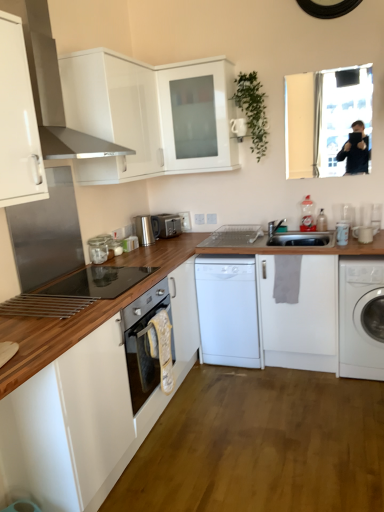
Image resolution: width=384 pixels, height=512 pixels. Describe the element at coordinates (150, 114) in the screenshot. I see `white glossy cabinet at upper center, acting as the fourth cabinetry starting from the bottom` at that location.

Identify the location of satin silver toaster at center, which is counted as the 1th appliance, starting from the left. This screenshot has width=384, height=512. (166, 225).

The width and height of the screenshot is (384, 512). Describe the element at coordinates (166, 225) in the screenshot. I see `satin silver toaster at center, the 1th appliance in the back-to-front sequence` at that location.

What are the coordinates of `white glossy mug at right, the 4th appliance positioned from the back` in the screenshot? It's located at (364, 233).

What do you see at coordinates (86, 389) in the screenshot?
I see `wooden countertop at center, which appears as the fifth cabinetry when viewed from the top` at bounding box center [86, 389].

This screenshot has height=512, width=384. In order to click on white plastic dishwasher at center, positioned as the 3th appliance in front-to-back order in this screenshot , I will do `click(233, 236)`.

Visually, is white plastic dishwasher at center, the 3th appliance from the right, positioned to the left or to the right of white matte dishwasher at center, acting as the 1th washing machine starting from the left?

white plastic dishwasher at center, the 3th appliance from the right, is to the right of white matte dishwasher at center, acting as the 1th washing machine starting from the left.

Who is bigger, white plastic dishwasher at center, the second appliance viewed from the back, or white matte dishwasher at center, acting as the 1th washing machine starting from the left?

With larger size is white matte dishwasher at center, acting as the 1th washing machine starting from the left.

Considering the points (252, 243) and (253, 287), which point is behind, point (252, 243) or point (253, 287)?

The point (252, 243) is more distant.

Between white plastic dishwasher at center, the 3th appliance from the right, and white matte dishwasher at center, marked as the 2th washing machine in a right-to-left arrangement, which one has smaller width?

Thinner between the two is white plastic dishwasher at center, the 3th appliance from the right.

Does clear glass jar at center, arranged as the second kitchen appliance when viewed from the top, turn towards white glossy cabinet at upper left, which ranks as the 3th cabinetry in bottom-to-top order?

No, clear glass jar at center, arranged as the second kitchen appliance when viewed from the top, is not oriented towards white glossy cabinet at upper left, which ranks as the 3th cabinetry in bottom-to-top order.

Which of these two, clear glass jar at center, arranged as the 2th kitchen appliance when viewed from the back, or white glossy cabinet at upper left, the third cabinetry when ordered from top to bottom, stands taller?

white glossy cabinet at upper left, the third cabinetry when ordered from top to bottom, is taller.

Could white glossy cabinet at upper left, the third cabinetry when ordered from top to bottom, be considered to be inside clear glass jar at center, the second kitchen appliance viewed from the right?

No, white glossy cabinet at upper left, the third cabinetry when ordered from top to bottom, is not a part of clear glass jar at center, the second kitchen appliance viewed from the right.

Does point (142, 243) appear closer or farther from the camera than point (340, 223)?

Point (142, 243).

From the image's perspective, which one is positioned lower, satin silver toaster at center, positioned as the second kitchen appliance in left-to-right order, or white glossy mug at right, which is counted as the 2th appliance, starting from the right?

white glossy mug at right, which is counted as the 2th appliance, starting from the right, from the image's perspective.

Is white glossy mug at right, which is counted as the 2th appliance, starting from the right, surrounded by satin silver toaster at center, positioned as the second kitchen appliance in left-to-right order?

That's incorrect, white glossy mug at right, which is counted as the 2th appliance, starting from the right, is not inside satin silver toaster at center, positioned as the second kitchen appliance in left-to-right order.

Is satin silver toaster at center, which is the first kitchen appliance from right to left, taller or shorter than white glossy mug at right, the 3th appliance positioned from the left?

In the image, satin silver toaster at center, which is the first kitchen appliance from right to left, appears to be taller than white glossy mug at right, the 3th appliance positioned from the left.

Is silver metallic faucet at center wider than wooden countertop at left, which is the fourth cabinetry from top to bottom?

Incorrect, the width of silver metallic faucet at center does not surpass that of wooden countertop at left, which is the fourth cabinetry from top to bottom.

From a real-world perspective, between silver metallic faucet at center and wooden countertop at left, which is the fourth cabinetry from top to bottom, who is vertically higher?

From a 3D spatial view, silver metallic faucet at center is above.

Is the position of silver metallic faucet at center more distant than that of wooden countertop at left, the second cabinetry when ordered from bottom to top?

Yes, silver metallic faucet at center is behind wooden countertop at left, the second cabinetry when ordered from bottom to top.

Which of these two, white plastic dishwasher at center, which is the second appliance from left to right, or metallic stainless steel range hood at upper left, stands shorter?

Standing shorter between the two is white plastic dishwasher at center, which is the second appliance from left to right.

Considering the positions of points (227, 234) and (33, 50), is point (227, 234) farther from camera compared to point (33, 50)?

Yes, it is behind point (33, 50).

Identify the location of appliance that is the 2nd object to the right of the metallic stainless steel range hood at upper left, starting at the anchor. This screenshot has height=512, width=384. click(233, 236).

How many degrees apart are the facing directions of white plastic dishwasher at center, positioned as the 3th appliance in front-to-back order, and metallic stainless steel range hood at upper left?

The facing directions of white plastic dishwasher at center, positioned as the 3th appliance in front-to-back order, and metallic stainless steel range hood at upper left are 90.1 degrees apart.

Is white glossy cabinet at upper left, the third cabinetry when ordered from top to bottom, to the left of white matte cabinet at upper center, which appears as the fifth cabinetry when ordered from the bottom, from the viewer's perspective?

Indeed, white glossy cabinet at upper left, the third cabinetry when ordered from top to bottom, is positioned on the left side of white matte cabinet at upper center, which appears as the fifth cabinetry when ordered from the bottom.

In terms of height, does white glossy cabinet at upper left, the third cabinetry when ordered from top to bottom, look taller or shorter compared to white matte cabinet at upper center, the first cabinetry from the top?

Clearly, white glossy cabinet at upper left, the third cabinetry when ordered from top to bottom, is shorter compared to white matte cabinet at upper center, the first cabinetry from the top.

From a real-world perspective, is white glossy cabinet at upper left, which ranks as the 3th cabinetry in bottom-to-top order, over white matte cabinet at upper center, which appears as the fifth cabinetry when ordered from the bottom?

No.

Consider the image. Does white glossy cabinet at upper left, the third cabinetry when ordered from top to bottom, have a smaller size compared to white matte cabinet at upper center, which appears as the fifth cabinetry when ordered from the bottom?

Yes.

Is silver metallic faucet at center further to camera compared to clear glass jar at center, the first kitchen appliance in the left-to-right sequence?

Yes, the depth of silver metallic faucet at center is greater than that of clear glass jar at center, the first kitchen appliance in the left-to-right sequence.

Which point is more distant from viewer, (279,221) or (93,255)?

The point (279,221) is farther.

From a real-world perspective, is silver metallic faucet at center physically above clear glass jar at center, which is the 1th kitchen appliance from front to back?

No, from a real-world perspective, silver metallic faucet at center is not above clear glass jar at center, which is the 1th kitchen appliance from front to back.

At what (x,y) coordinates should I click in order to perform the action: click on kitchen appliance in front of the silver metallic faucet at center. Please return your answer as a coordinate pair (x, y). This screenshot has width=384, height=512. Looking at the image, I should click on (98, 250).

From a real-world perspective, starting from the white matte dishwasher at center, acting as the 1th washing machine starting from the left, which appliance is the 1st one vertically above it? Please provide its 2D coordinates.

[(233, 236)]

Locate an element on the screen. The height and width of the screenshot is (512, 384). the 1st cabinetry above the clear glass jar at center, arranged as the 2th kitchen appliance when viewed from the back (from the image's perspective) is located at coordinates (18, 121).

Based on their spatial positions, is silver metallic faucet at center or white plastic dishwasher at center, the 3th appliance from the right, closer to white glossy cabinet at upper center, acting as the fourth cabinetry starting from the bottom?

white plastic dishwasher at center, the 3th appliance from the right, is positioned closer to the anchor white glossy cabinet at upper center, acting as the fourth cabinetry starting from the bottom.

Which object lies further to the anchor point satin silver toaster at center, the 1th kitchen appliance in the back-to-front sequence, white glossy cabinet at upper center, which appears as the second cabinetry when viewed from the top, or white matte cabinet at upper center, which appears as the fifth cabinetry when ordered from the bottom?

white matte cabinet at upper center, which appears as the fifth cabinetry when ordered from the bottom, is further to satin silver toaster at center, the 1th kitchen appliance in the back-to-front sequence.

Based on their spatial positions, is satin silver toaster at center, which is the first kitchen appliance from right to left, or white matte dishwasher at center, acting as the 1th washing machine starting from the left, closer to satin silver toaster at center, which ranks as the 4th appliance in right-to-left order?

satin silver toaster at center, which is the first kitchen appliance from right to left, is positioned closer to the anchor satin silver toaster at center, which ranks as the 4th appliance in right-to-left order.

Looking at this image, when comparing their distances from white glossy cabinet at upper left, the third cabinetry when ordered from top to bottom, does wooden countertop at left, which is the fourth cabinetry from top to bottom, or white matte cabinet at upper center, which appears as the fifth cabinetry when ordered from the bottom, seem further?

The object further to white glossy cabinet at upper left, the third cabinetry when ordered from top to bottom, is white matte cabinet at upper center, which appears as the fifth cabinetry when ordered from the bottom.

Based on their spatial positions, is satin silver toaster at center, which ranks as the 4th appliance in right-to-left order, or white glossy mug at right, the 4th appliance when ordered from left to right, closer to white matte washing machine at right, the second washing machine viewed from the left?

Among the two, white glossy mug at right, the 4th appliance when ordered from left to right, is located nearer to white matte washing machine at right, the second washing machine viewed from the left.

When comparing their distances from satin silver toaster at center, positioned as the fourth appliance in front-to-back order, does satin silver toaster at center, placed as the 1th kitchen appliance when sorted from top to bottom, or white glossy mug at right, the 4th appliance positioned from the back, seem closer?

satin silver toaster at center, placed as the 1th kitchen appliance when sorted from top to bottom, is closer to satin silver toaster at center, positioned as the fourth appliance in front-to-back order.

Looking at this image, looking at the image, which one is located further to satin silver toaster at center, which is the first kitchen appliance from right to left, white glossy cabinet at upper left, which ranks as the 3th cabinetry in bottom-to-top order, or clear glass jar at center, which is the 1th kitchen appliance from front to back?

The object further to satin silver toaster at center, which is the first kitchen appliance from right to left, is white glossy cabinet at upper left, which ranks as the 3th cabinetry in bottom-to-top order.

Which object lies further to the anchor point white glossy cabinet at upper center, acting as the fourth cabinetry starting from the bottom, satin silver toaster at center, the 1th appliance in the back-to-front sequence, or satin silver toaster at center, the 1th kitchen appliance in the back-to-front sequence?

satin silver toaster at center, the 1th appliance in the back-to-front sequence, is further to white glossy cabinet at upper center, acting as the fourth cabinetry starting from the bottom.

At what (x,y) coordinates should I click in order to perform the action: click on home appliance between white matte cabinet at upper center, which appears as the fifth cabinetry when ordered from the bottom, and wooden countertop at left, which is the fourth cabinetry from top to bottom, in the up-down direction. Please return your answer as a coordinate pair (x, y). The image size is (384, 512). Looking at the image, I should click on (52, 88).

You are a GUI agent. You are given a task and a screenshot of the screen. Output one action in this format:
    pyautogui.click(x=<x>, y=<y>)
    Task: Click on the kitchen appliance between white glossy cabinet at upper left, which ranks as the 3th cabinetry in bottom-to-top order, and silver metallic faucet at center from front to back
    This screenshot has height=512, width=384.
    Given the screenshot: What is the action you would take?
    click(x=98, y=250)

The height and width of the screenshot is (512, 384). I want to click on home appliance positioned between wooden countertop at left, which is the fourth cabinetry from top to bottom, and white plastic dishwasher at center, which is the second appliance from left to right, from near to far, so click(x=52, y=88).

This screenshot has width=384, height=512. What are the coordinates of `home appliance between wooden countertop at left, which is the fourth cabinetry from top to bottom, and satin silver toaster at center, which ranks as the second kitchen appliance in front-to-back order, from front to back` in the screenshot? It's located at (52, 88).